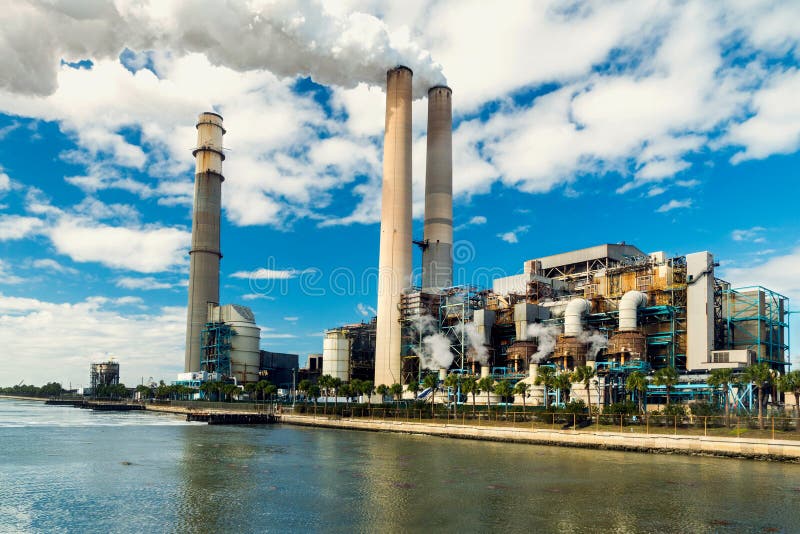
Identify the location of chimney. (406, 219).